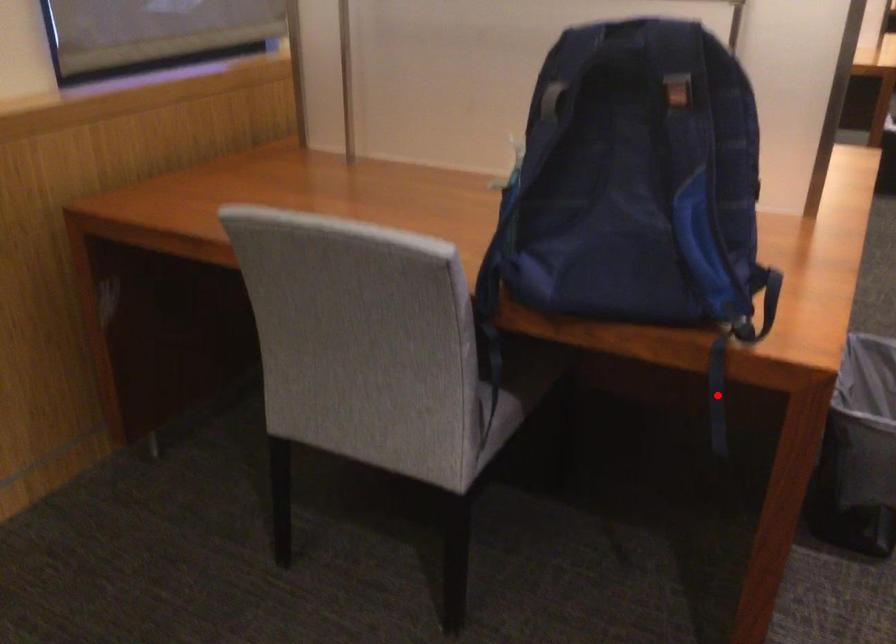
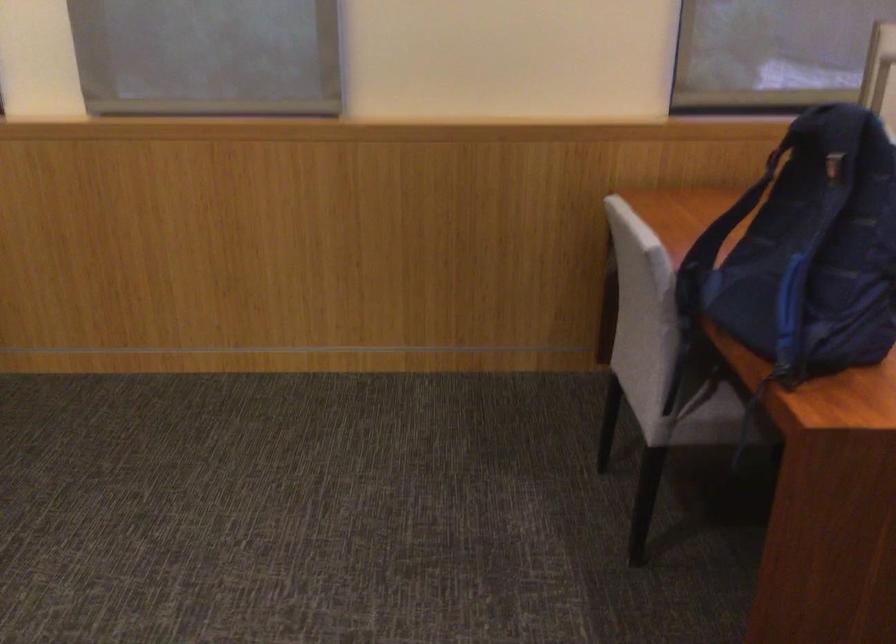
Question: I am providing you with two images of the same scene from different viewpoints. A red point is marked on the first image. Is the red point's position out of view in image 2?

Choices:
 (A) Yes
 (B) No

Answer: (A)